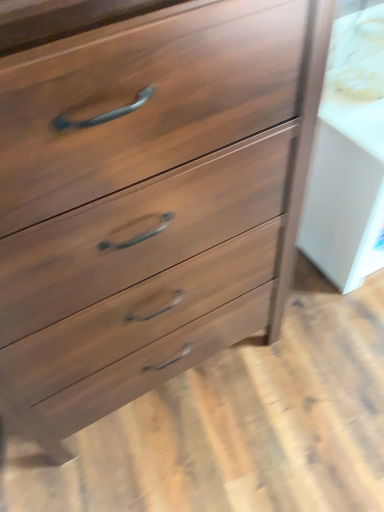
Describe the element at coordinates (349, 156) in the screenshot. I see `white glossy cabinet at right` at that location.

I want to click on white glossy cabinet at right, so click(349, 156).

What is the approximate height of white glossy cabinet at right?

It is 24.66 inches.

Identify the location of white glossy cabinet at right. (349, 156).